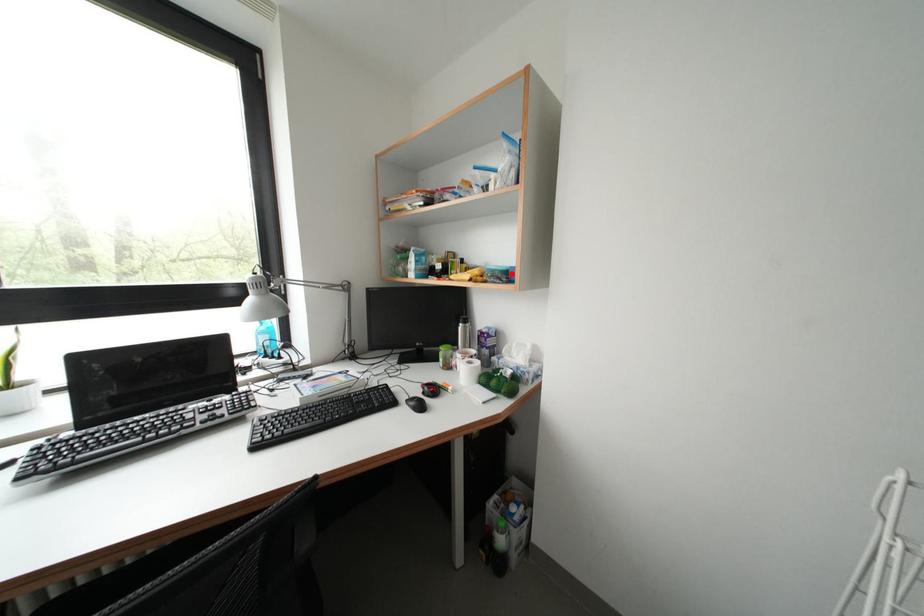
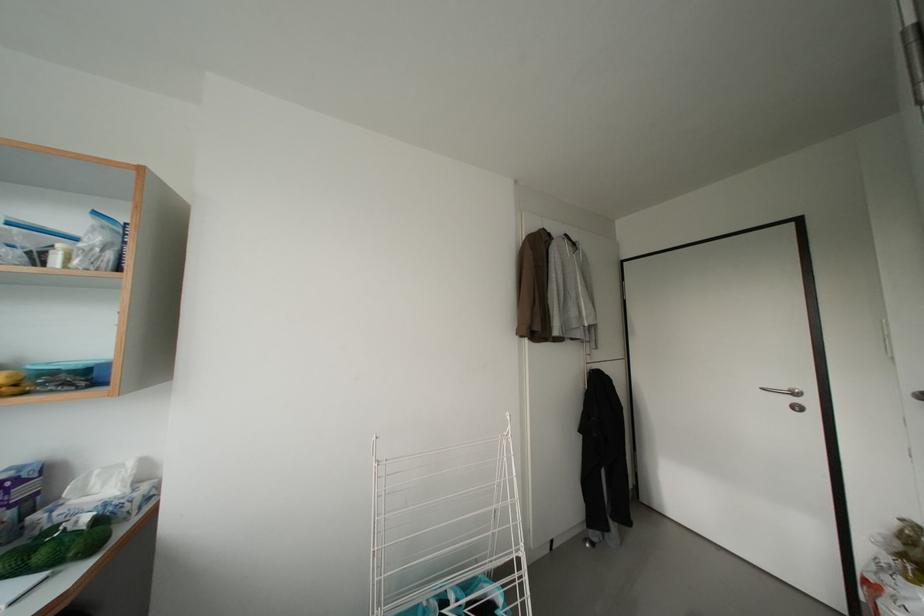
The point at the highlighted location is marked in the first image. Where is the corresponding point in the second image?

(88, 371)